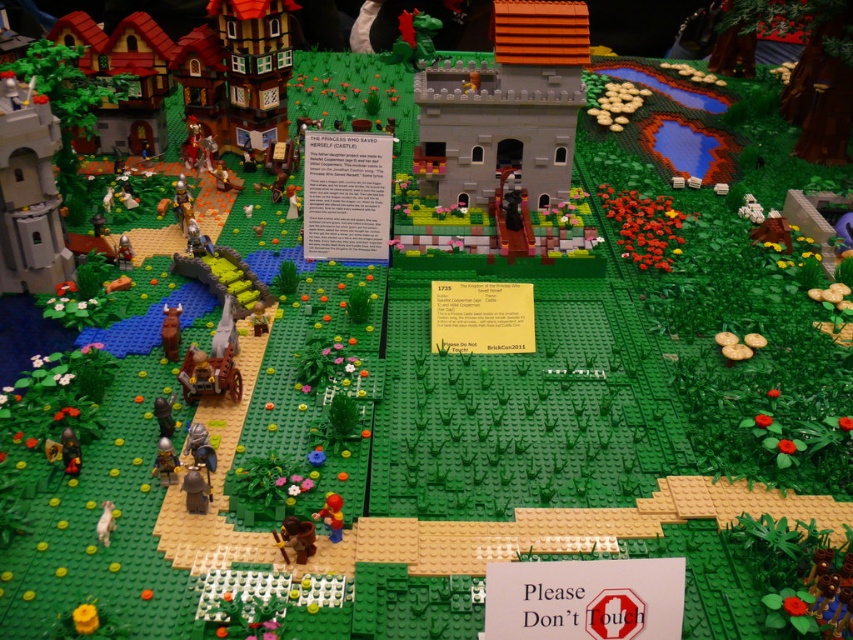
You are a tiny Lego character standing on the dirt path in the foreground. You want to climb the light gray stone tower at left and the bright red plastic figure at center. Which one is easier to climb?

The light gray stone tower at left is taller than the bright red plastic figure at center, so it might be harder to climb. The bright red plastic figure at center is shorter and easier to climb.

In the Lego diorama, there is a bright red plastic figure at center and a light brown wooden horse at lower left. From the perspective of someone standing at the lower edge of the image, which object is positioned to the right?

The bright red plastic figure at center is to the right of the light brown wooden horse at lower left.